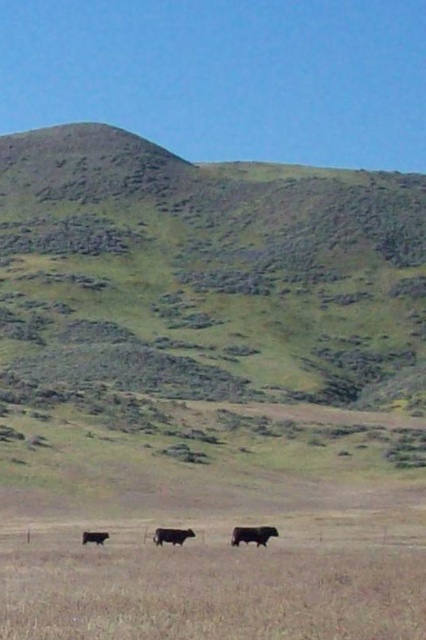
Question: Does green grassy hillside at center appear under black matte cow at center?

Choices:
 (A) no
 (B) yes

Answer: (A)

Question: Which point appears closest to the camera in this image?

Choices:
 (A) (249, 541)
 (B) (94, 541)
 (C) (161, 260)
 (D) (164, 528)

Answer: (A)

Question: Can you confirm if green grassy hillside at center is positioned above black matte cow at center?

Choices:
 (A) no
 (B) yes

Answer: (B)

Question: Among these points, which one is farthest from the camera?

Choices:
 (A) (92, 538)
 (B) (238, 531)
 (C) (287, 282)

Answer: (C)

Question: Which point is farther to the camera?

Choices:
 (A) shiny brown cow at lower left
 (B) black matte cow at center
 (C) green grassy hillside at center

Answer: (C)

Question: Can you confirm if green grassy hillside at center is thinner than black matte cow at center?

Choices:
 (A) no
 (B) yes

Answer: (A)